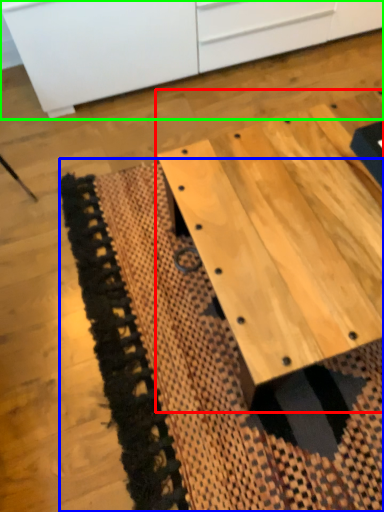
Question: Estimate the real-world distances between objects in this image. Which object is closer to table (highlighted by a red box), mat (highlighted by a blue box) or cabinetry (highlighted by a green box)?

Choices:
 (A) mat
 (B) cabinetry

Answer: (A)